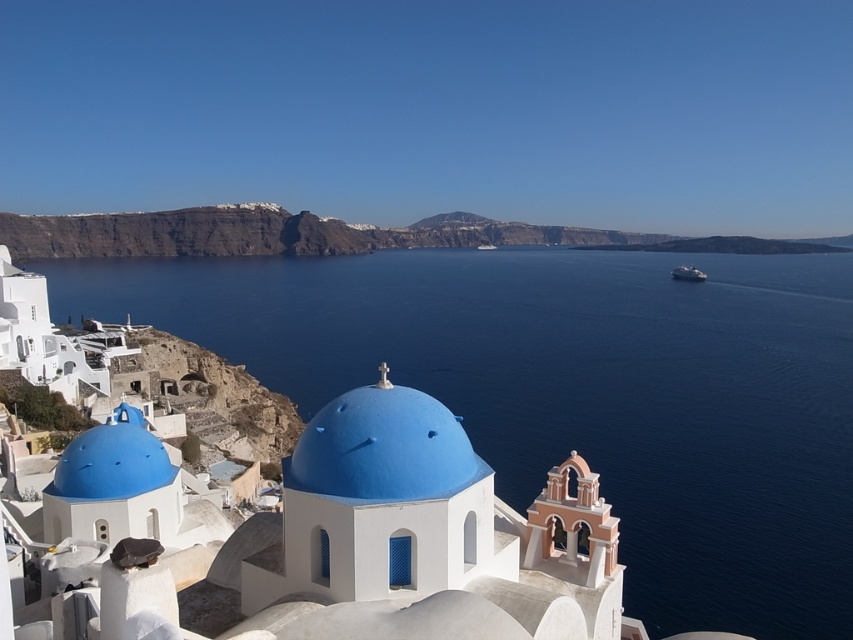
Question: Which object is closer to the camera taking this photo?

Choices:
 (A) blue matte dome at center
 (B) white glossy ship at right
 (C) white glossy boat at center

Answer: (A)

Question: Among these objects, which one is nearest to the camera?

Choices:
 (A) white glossy boat at center
 (B) white glossy ship at right
 (C) matte blue dome at lower left

Answer: (C)

Question: Which object appears farthest from the camera in this image?

Choices:
 (A) white glossy boat at center
 (B) blue liquid water at center
 (C) blue matte dome at center

Answer: (A)

Question: Considering the relative positions of blue liquid water at center and white glossy ship at right in the image provided, where is blue liquid water at center located with respect to white glossy ship at right?

Choices:
 (A) left
 (B) right

Answer: (A)

Question: Is blue liquid water at center above blue matte dome at center?

Choices:
 (A) no
 (B) yes

Answer: (B)

Question: Can you confirm if white glossy ship at right is wider than white glossy boat at center?

Choices:
 (A) yes
 (B) no

Answer: (A)